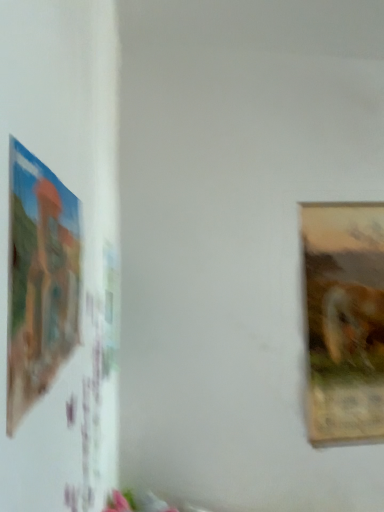
Describe the element at coordinates (39, 280) in the screenshot. I see `matte plastic picture frame at left, marked as the second picture frame in a back-to-front arrangement` at that location.

Image resolution: width=384 pixels, height=512 pixels. Find the location of `matte plastic picture frame at left, marked as the second picture frame in a back-to-front arrangement`. matte plastic picture frame at left, marked as the second picture frame in a back-to-front arrangement is located at coordinates (39, 280).

Find the location of a particular element. wooden textured frame at right, arranged as the 2th picture frame when viewed from the front is located at coordinates (345, 319).

The height and width of the screenshot is (512, 384). What do you see at coordinates (345, 319) in the screenshot?
I see `wooden textured frame at right, the second picture frame in the left-to-right sequence` at bounding box center [345, 319].

I want to click on matte plastic picture frame at left, the 1th picture frame in the front-to-back sequence, so click(x=39, y=280).

Can you confirm if wooden textured frame at right, marked as the 1th picture frame in a back-to-front arrangement, is positioned to the right of matte plastic picture frame at left, arranged as the first picture frame when viewed from the left?

Yes.

From the picture: Which object is more forward, wooden textured frame at right, marked as the 1th picture frame in a back-to-front arrangement, or matte plastic picture frame at left, the 1th picture frame in the front-to-back sequence?

Positioned in front is matte plastic picture frame at left, the 1th picture frame in the front-to-back sequence.

Is point (356, 342) positioned in front of point (76, 310)?

That is False.

From the image's perspective, would you say wooden textured frame at right, arranged as the 2th picture frame when viewed from the front, is positioned over matte plastic picture frame at left, arranged as the first picture frame when viewed from the left?

No, from the image's perspective, wooden textured frame at right, arranged as the 2th picture frame when viewed from the front, is not over matte plastic picture frame at left, arranged as the first picture frame when viewed from the left.

From a real-world perspective, is wooden textured frame at right, arranged as the 2th picture frame when viewed from the front, beneath matte plastic picture frame at left, the 1th picture frame in the front-to-back sequence?

Yes, from a real-world perspective, wooden textured frame at right, arranged as the 2th picture frame when viewed from the front, is beneath matte plastic picture frame at left, the 1th picture frame in the front-to-back sequence.

In terms of width, does wooden textured frame at right, positioned as the 1th picture frame in right-to-left order, look wider or thinner when compared to matte plastic picture frame at left, the 2th picture frame from the right?

Clearly, wooden textured frame at right, positioned as the 1th picture frame in right-to-left order, has more width compared to matte plastic picture frame at left, the 2th picture frame from the right.

Can you confirm if wooden textured frame at right, arranged as the 2th picture frame when viewed from the front, is taller than matte plastic picture frame at left, arranged as the first picture frame when viewed from the left?

Yes, wooden textured frame at right, arranged as the 2th picture frame when viewed from the front, is taller than matte plastic picture frame at left, arranged as the first picture frame when viewed from the left.

Is wooden textured frame at right, marked as the 1th picture frame in a back-to-front arrangement, bigger than matte plastic picture frame at left, marked as the second picture frame in a back-to-front arrangement?

Correct, wooden textured frame at right, marked as the 1th picture frame in a back-to-front arrangement, is larger in size than matte plastic picture frame at left, marked as the second picture frame in a back-to-front arrangement.

Is matte plastic picture frame at left, the 1th picture frame in the front-to-back sequence, located within wooden textured frame at right, arranged as the 2th picture frame when viewed from the front?

No.

Are wooden textured frame at right, positioned as the 1th picture frame in right-to-left order, and matte plastic picture frame at left, the 1th picture frame in the front-to-back sequence, making contact?

wooden textured frame at right, positioned as the 1th picture frame in right-to-left order, and matte plastic picture frame at left, the 1th picture frame in the front-to-back sequence, are clearly separated.

Is wooden textured frame at right, the second picture frame in the left-to-right sequence, oriented away from matte plastic picture frame at left, the 1th picture frame in the front-to-back sequence?

No, wooden textured frame at right, the second picture frame in the left-to-right sequence,'s orientation is not away from matte plastic picture frame at left, the 1th picture frame in the front-to-back sequence.

This screenshot has width=384, height=512. Find the location of `picture frame above the wooden textured frame at right, arranged as the 2th picture frame when viewed from the front (from a real-world perspective)`. picture frame above the wooden textured frame at right, arranged as the 2th picture frame when viewed from the front (from a real-world perspective) is located at coordinates (39, 280).

Does matte plastic picture frame at left, arranged as the first picture frame when viewed from the left, appear on the left side of wooden textured frame at right, arranged as the 2th picture frame when viewed from the front?

Indeed, matte plastic picture frame at left, arranged as the first picture frame when viewed from the left, is positioned on the left side of wooden textured frame at right, arranged as the 2th picture frame when viewed from the front.

Is matte plastic picture frame at left, arranged as the first picture frame when viewed from the left, behind wooden textured frame at right, arranged as the 2th picture frame when viewed from the front?

That is False.

Considering the points (38, 200) and (367, 317), which point is behind, point (38, 200) or point (367, 317)?

Positioned behind is point (367, 317).

In the scene shown: From the image's perspective, is matte plastic picture frame at left, marked as the second picture frame in a back-to-front arrangement, located above or below wooden textured frame at right, the second picture frame in the left-to-right sequence?

From the image's perspective, matte plastic picture frame at left, marked as the second picture frame in a back-to-front arrangement, appears above wooden textured frame at right, the second picture frame in the left-to-right sequence.

Looking at this image, from a real-world perspective, is matte plastic picture frame at left, the 2th picture frame from the right, positioned above or below wooden textured frame at right, the second picture frame in the left-to-right sequence?

Clearly, from a real-world perspective, matte plastic picture frame at left, the 2th picture frame from the right, is above wooden textured frame at right, the second picture frame in the left-to-right sequence.

Which object is thinner, matte plastic picture frame at left, arranged as the first picture frame when viewed from the left, or wooden textured frame at right, positioned as the 1th picture frame in right-to-left order?

With smaller width is matte plastic picture frame at left, arranged as the first picture frame when viewed from the left.

In terms of height, does matte plastic picture frame at left, marked as the second picture frame in a back-to-front arrangement, look taller or shorter compared to wooden textured frame at right, positioned as the 1th picture frame in right-to-left order?

matte plastic picture frame at left, marked as the second picture frame in a back-to-front arrangement, is shorter than wooden textured frame at right, positioned as the 1th picture frame in right-to-left order.

Between matte plastic picture frame at left, marked as the second picture frame in a back-to-front arrangement, and wooden textured frame at right, the second picture frame in the left-to-right sequence, which one has larger size?

Bigger between the two is wooden textured frame at right, the second picture frame in the left-to-right sequence.

Choose the correct answer: Is matte plastic picture frame at left, arranged as the first picture frame when viewed from the left, inside wooden textured frame at right, marked as the 1th picture frame in a back-to-front arrangement, or outside it?

matte plastic picture frame at left, arranged as the first picture frame when viewed from the left, is located beyond the bounds of wooden textured frame at right, marked as the 1th picture frame in a back-to-front arrangement.

Are matte plastic picture frame at left, arranged as the first picture frame when viewed from the left, and wooden textured frame at right, marked as the 1th picture frame in a back-to-front arrangement, far apart?

matte plastic picture frame at left, arranged as the first picture frame when viewed from the left, is far away from wooden textured frame at right, marked as the 1th picture frame in a back-to-front arrangement.

Is matte plastic picture frame at left, arranged as the first picture frame when viewed from the left, oriented towards wooden textured frame at right, the second picture frame in the left-to-right sequence?

No.

How many degrees apart are the facing directions of matte plastic picture frame at left, the 2th picture frame from the right, and wooden textured frame at right, marked as the 1th picture frame in a back-to-front arrangement?

The angle between the facing direction of matte plastic picture frame at left, the 2th picture frame from the right, and the facing direction of wooden textured frame at right, marked as the 1th picture frame in a back-to-front arrangement, is 90.2 degrees.

Measure the distance from matte plastic picture frame at left, the 1th picture frame in the front-to-back sequence, to wooden textured frame at right, positioned as the 1th picture frame in right-to-left order.

The distance of matte plastic picture frame at left, the 1th picture frame in the front-to-back sequence, from wooden textured frame at right, positioned as the 1th picture frame in right-to-left order, is 4.48 feet.

The height and width of the screenshot is (512, 384). In order to click on picture frame above the wooden textured frame at right, the second picture frame in the left-to-right sequence (from a real-world perspective) in this screenshot , I will do `click(39, 280)`.

Where is `picture frame on the right of matte plastic picture frame at left, the 2th picture frame from the right`? picture frame on the right of matte plastic picture frame at left, the 2th picture frame from the right is located at coordinates (345, 319).

Locate an element on the screen. picture frame in front of the wooden textured frame at right, positioned as the 1th picture frame in right-to-left order is located at coordinates (39, 280).